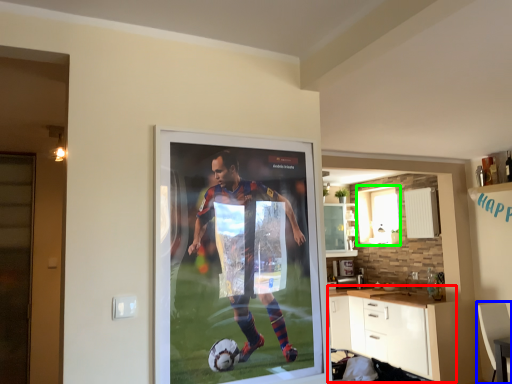
Question: Estimate the real-world distances between objects in this image. Which object is closer to cabinetry (highlighted by a red box), armchair (highlighted by a blue box) or window (highlighted by a green box)?

Choices:
 (A) armchair
 (B) window

Answer: (A)